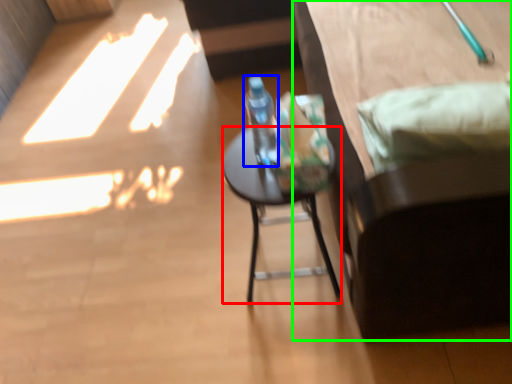
Question: Which is nearer to the desk (highlighted by a red box)? bottle (highlighted by a blue box) or furniture (highlighted by a green box).

Choices:
 (A) bottle
 (B) furniture

Answer: (A)